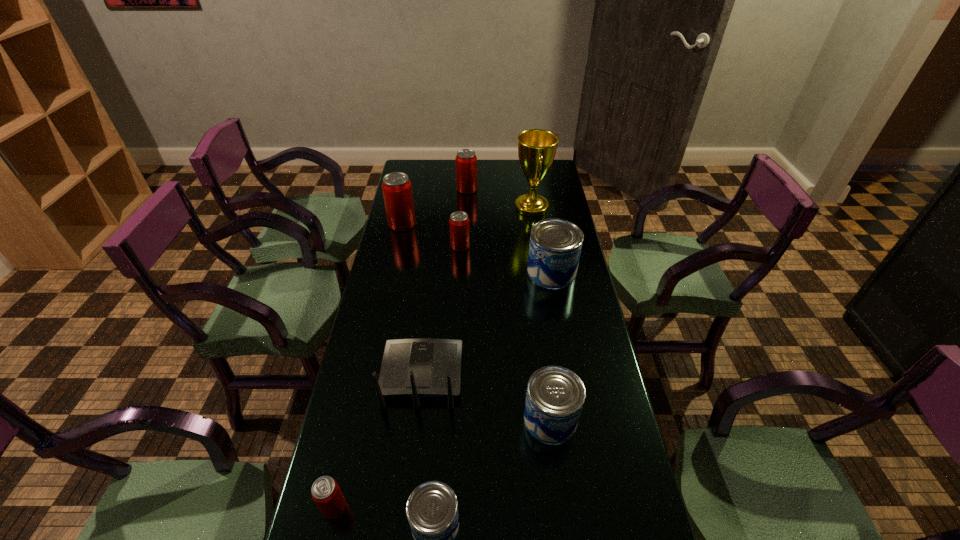
This screenshot has width=960, height=540. I want to click on free location at the right edge, so click(x=594, y=324).

In the image, there is a desktop. Identify the location of free region at the far left corner. (425, 181).

You are a GUI agent. You are given a task and a screenshot of the screen. Output one action in this format:
    pyautogui.click(x=<x>, y=<y>)
    Task: Click on the vacant area between the fifth nearest object and the third nearest red can
    
    Given the screenshot: What is the action you would take?
    point(477,248)

The width and height of the screenshot is (960, 540). In order to click on vacant region between the biggest red can and the farthest red can in this screenshot , I will do `click(435, 207)`.

Where is `free space between the fourth farthest can and the second farthest red can`? free space between the fourth farthest can and the second farthest red can is located at coordinates (477, 248).

Where is `object that is the fourth closest to the second farthest blue can`? object that is the fourth closest to the second farthest blue can is located at coordinates (326, 493).

Select which object appears as the eighth closest to the router. Please provide its 2D coordinates. Your answer should be formatted as a tuple, i.e. [(x, y)], where the tuple contains the x and y coordinates of a point satisfying the conditions above.

[(466, 161)]

Locate which can is the sixth closest to the smallest red can. Please provide its 2D coordinates. Your answer should be formatted as a tuple, i.e. [(x, y)], where the tuple contains the x and y coordinates of a point satisfying the conditions above.

[(466, 161)]

Locate which can is the third closest to the second farthest red can. Please provide its 2D coordinates. Your answer should be formatted as a tuple, i.e. [(x, y)], where the tuple contains the x and y coordinates of a point satisfying the conditions above.

[(555, 246)]

Select which red can is the third closest to the gold award. Please provide its 2D coordinates. Your answer should be formatted as a tuple, i.e. [(x, y)], where the tuple contains the x and y coordinates of a point satisfying the conditions above.

[(397, 191)]